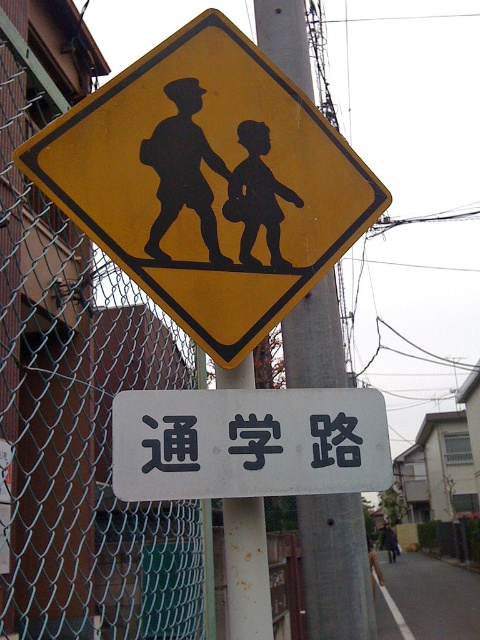
Question: Can you confirm if metallic gray pole at center is positioned above black silhouette at upper center?

Choices:
 (A) no
 (B) yes

Answer: (A)

Question: From the image, what is the correct spatial relationship of yellow matte pedestrian crossing sign at upper center in relation to white plastic sign at center?

Choices:
 (A) right
 (B) left

Answer: (B)

Question: Among these points, which one is nearest to the camera?

Choices:
 (A) (358, 438)
 (B) (182, 88)
 (C) (15, 3)
 (D) (158, 198)

Answer: (A)

Question: Which is nearer to the green chain-link fence at left?

Choices:
 (A) metallic wire at upper center
 (B) black silhouette at upper center
 (C) white plastic sign at center

Answer: (B)

Question: Can you confirm if white plastic sign at center is positioned to the left of blackmaterial/texture at center?

Choices:
 (A) yes
 (B) no

Answer: (B)

Question: Which point appears farthest from the camera in this image?

Choices:
 (A) coord(23,125)
 (B) coord(147,452)

Answer: (A)